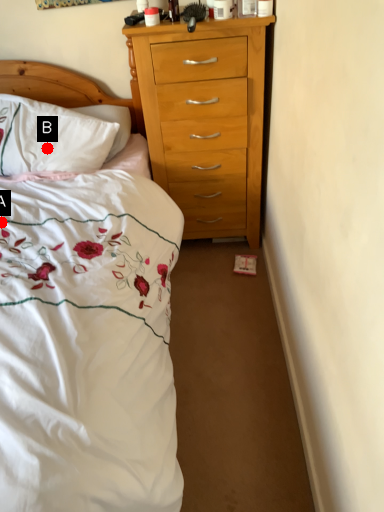
Question: Two points are circled on the image, labeled by A and B beside each circle. Which point is closer to the camera?

Choices:
 (A) A is closer
 (B) B is closer

Answer: (A)